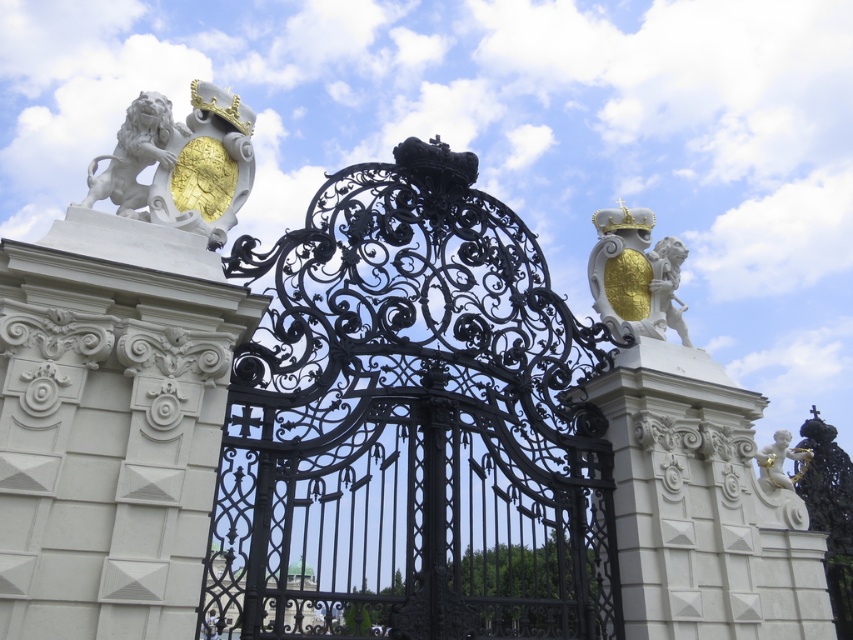
Question: Does white stone lion at upper left have a larger size compared to white marble lion at upper left?

Choices:
 (A) no
 (B) yes

Answer: (B)

Question: Which point is farther to the camera?

Choices:
 (A) (196, 124)
 (B) (141, 132)

Answer: (A)

Question: Is white stone lion at upper left thinner than gold textured shield with cherub at upper right?

Choices:
 (A) yes
 (B) no

Answer: (A)

Question: Which object is the farthest from the gold metallic cherub at right?

Choices:
 (A) white stone lion at upper left
 (B) gold textured shield with cherub at upper right

Answer: (A)

Question: Does white stone lion at upper left have a greater width compared to gold textured shield with cherub at upper right?

Choices:
 (A) yes
 (B) no

Answer: (B)

Question: Which point appears closest to the camera in this image?

Choices:
 (A) (664, 307)
 (B) (141, 157)
 (C) (782, 445)
 (D) (206, 180)

Answer: (B)